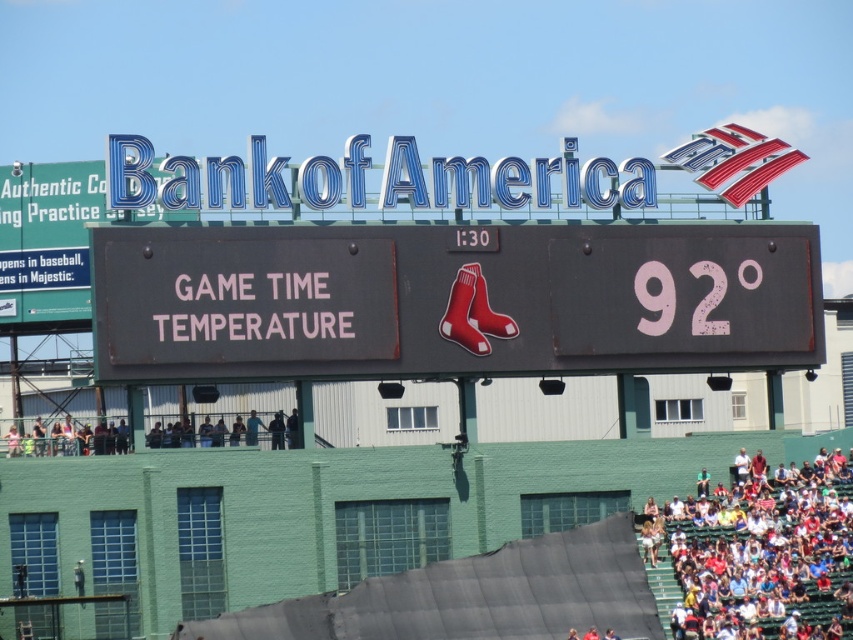
You are sitting in the baseball stadium and want to see which area is higher between the white fabric seats at lower right and the dark gray concrete crowd at lower left. Which one is taller?

The white fabric seats at lower right is much taller than the dark gray concrete crowd at lower left according to the description.

You are a photographer trying to capture the entire black matte scoreboard at center and the dark gray concrete crowd at lower left in one shot. Based on their heights, which object should you focus on to ensure both are visible without cropping?

The black matte scoreboard at center has a greater height compared to the dark gray concrete crowd at lower left. To ensure both are visible without cropping, focus on the black matte scoreboard at center as it is taller and requires more vertical space.

You are standing at the center of the baseball stadium and see the point marked at coordinates (451, 300). What is the nearest object to this point?

The point is located on the black matte scoreboard at center, so the nearest object to this point is the scoreboard itself.